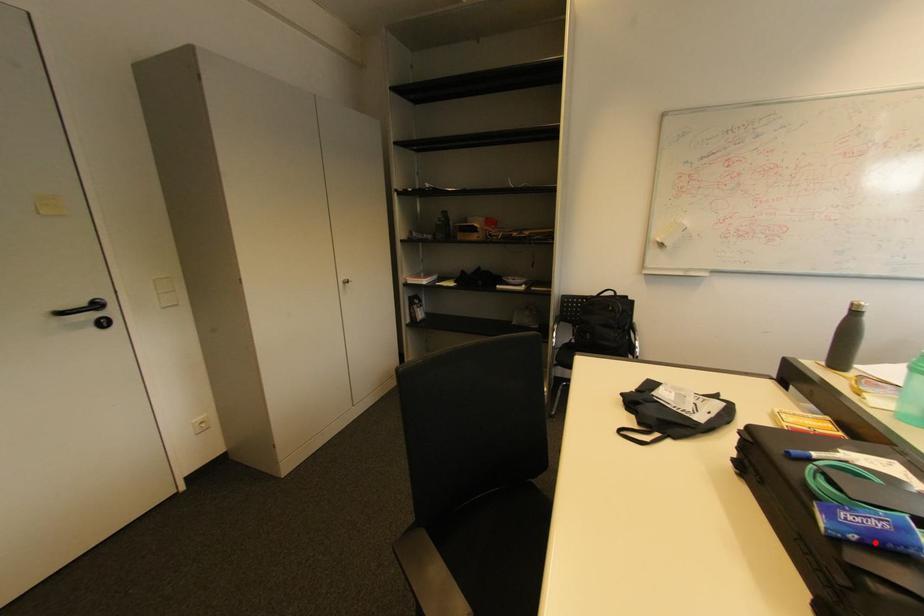
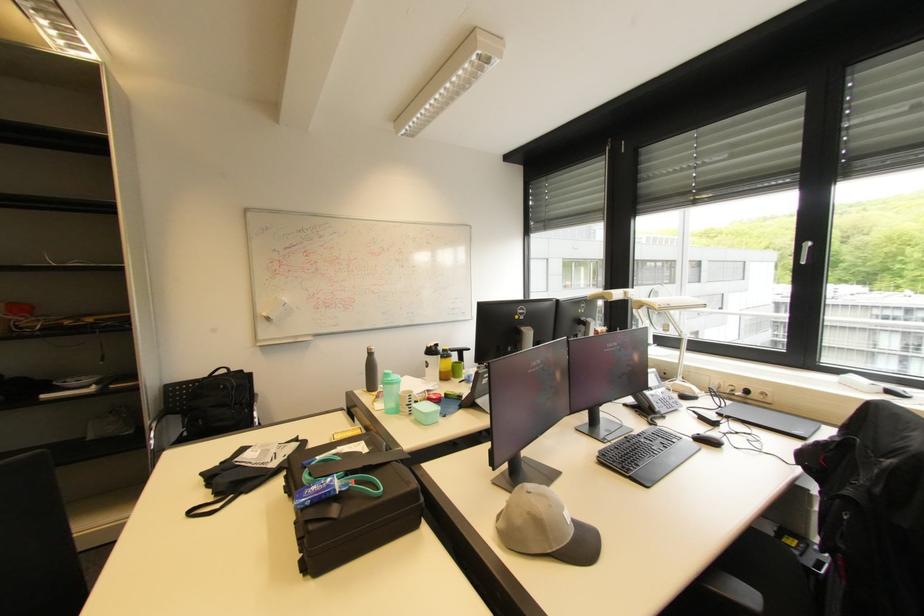
Question: I am providing you with two images of the same scene from different viewpoints. Image1 has a red point marked. In image2, the corresponding 3D location appears at what relative position? Reply with the corresponding letter.

Choices:
 (A) Closer
 (B) Farther

Answer: (B)